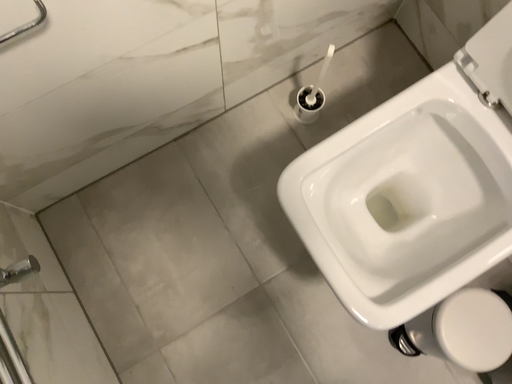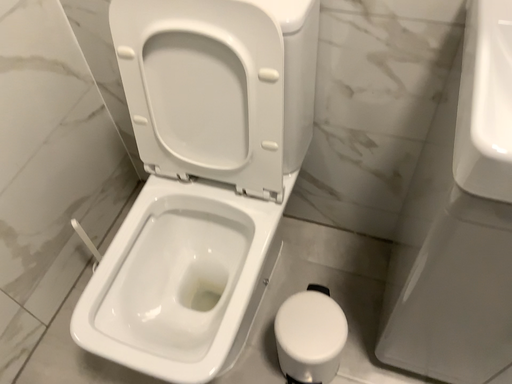
Question: Which way did the camera rotate in the video?

Choices:
 (A) rotated upward
 (B) rotated downward

Answer: (A)